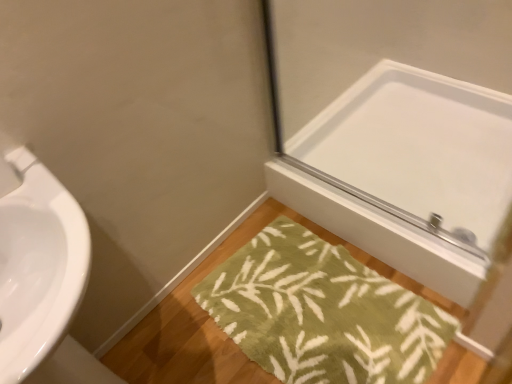
Question: From the image's perspective, is white glossy mirror at upper right above or below green fuzzy bath mat at lower center?

Choices:
 (A) below
 (B) above

Answer: (B)

Question: Visually, is white glossy mirror at upper right positioned to the left or to the right of green fuzzy bath mat at lower center?

Choices:
 (A) right
 (B) left

Answer: (A)

Question: Considering their positions, is white glossy mirror at upper right located in front of or behind green fuzzy bath mat at lower center?

Choices:
 (A) front
 (B) behind

Answer: (B)

Question: From the image's perspective, is green fuzzy bath mat at lower center above or below white glossy mirror at upper right?

Choices:
 (A) above
 (B) below

Answer: (B)

Question: From a real-world perspective, is green fuzzy bath mat at lower center positioned above or below white glossy mirror at upper right?

Choices:
 (A) below
 (B) above

Answer: (A)

Question: Considering the positions of point click(x=402, y=289) and point click(x=490, y=233), is point click(x=402, y=289) closer or farther from the camera than point click(x=490, y=233)?

Choices:
 (A) farther
 (B) closer

Answer: (A)

Question: Is green fuzzy bath mat at lower center bigger or smaller than white glossy mirror at upper right?

Choices:
 (A) big
 (B) small

Answer: (B)